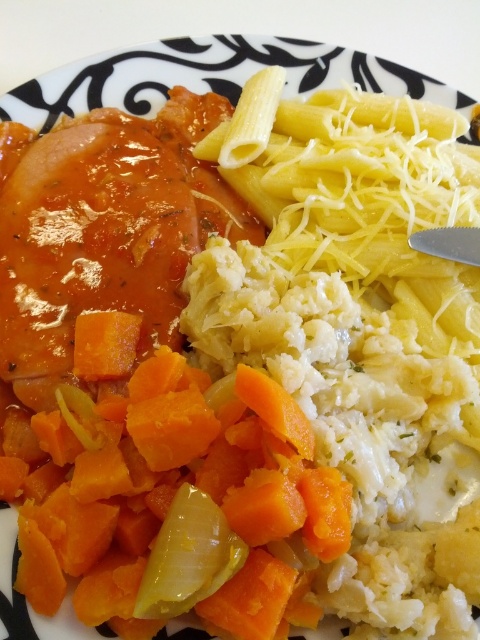
Which is more to the right, orange smooth carrot at left or yellow translucent onion at lower center?

Positioned to the right is yellow translucent onion at lower center.

The image size is (480, 640). Identify the location of orange smooth carrot at left. (168, 493).